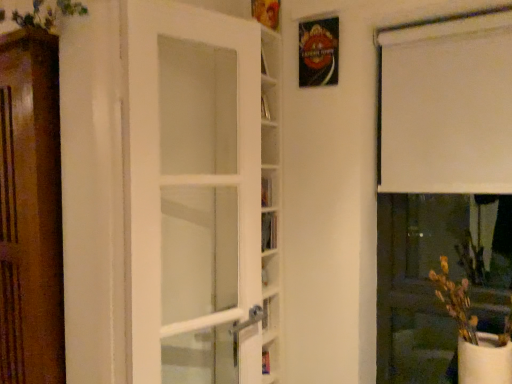
Question: Does hardcover book at center appear on the right side of white matte curtain at upper right?

Choices:
 (A) no
 (B) yes

Answer: (A)

Question: From a real-world perspective, is hardcover book at center under white matte curtain at upper right?

Choices:
 (A) no
 (B) yes

Answer: (B)

Question: Is hardcover book at center further to camera compared to white matte curtain at upper right?

Choices:
 (A) no
 (B) yes

Answer: (B)

Question: Does hardcover book at center have a greater height compared to white matte curtain at upper right?

Choices:
 (A) no
 (B) yes

Answer: (A)

Question: Would you say hardcover book at center is a long distance from white matte curtain at upper right?

Choices:
 (A) yes
 (B) no

Answer: (B)

Question: Considering the positions of white matte curtain at upper right and white matte vase at lower right in the image, is white matte curtain at upper right wider or thinner than white matte vase at lower right?

Choices:
 (A) wide
 (B) thin

Answer: (B)

Question: Considering their positions, is white matte curtain at upper right located in front of or behind white matte vase at lower right?

Choices:
 (A) front
 (B) behind

Answer: (B)

Question: Is white matte curtain at upper right inside or outside of white matte vase at lower right?

Choices:
 (A) outside
 (B) inside

Answer: (A)

Question: Based on their positions, is white matte curtain at upper right located to the left or right of white matte vase at lower right?

Choices:
 (A) left
 (B) right

Answer: (B)

Question: In the image, is white matte curtain at upper right on the left side or the right side of hardcover book at center?

Choices:
 (A) right
 (B) left

Answer: (A)

Question: Based on their sizes in the image, would you say white matte curtain at upper right is bigger or smaller than hardcover book at center?

Choices:
 (A) small
 (B) big

Answer: (B)

Question: Is white matte curtain at upper right in front of or behind hardcover book at center in the image?

Choices:
 (A) behind
 (B) front

Answer: (B)

Question: From a real-world perspective, is white matte curtain at upper right physically located above or below hardcover book at center?

Choices:
 (A) above
 (B) below

Answer: (A)

Question: Which is correct: white glass door at center is inside hardcover book at center, or outside of it?

Choices:
 (A) inside
 (B) outside

Answer: (B)

Question: Is white glass door at center in front of or behind hardcover book at center in the image?

Choices:
 (A) front
 (B) behind

Answer: (A)